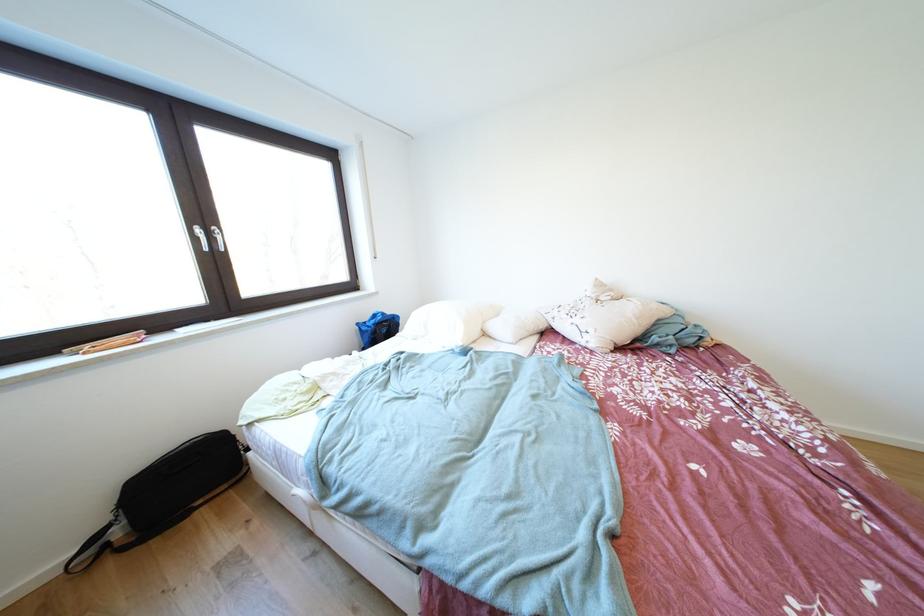
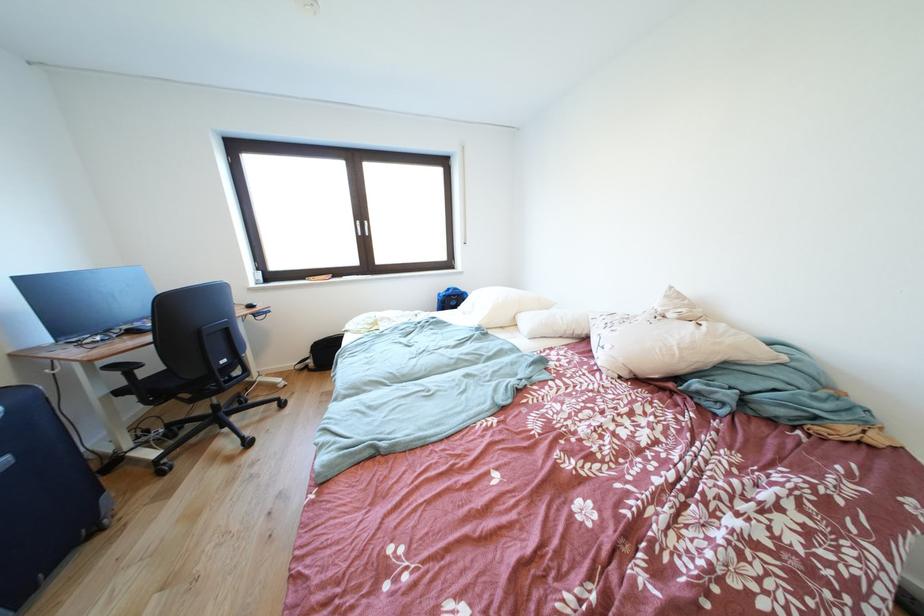
Find the pixel in the second image that matches (367,329) in the first image.

(447, 299)